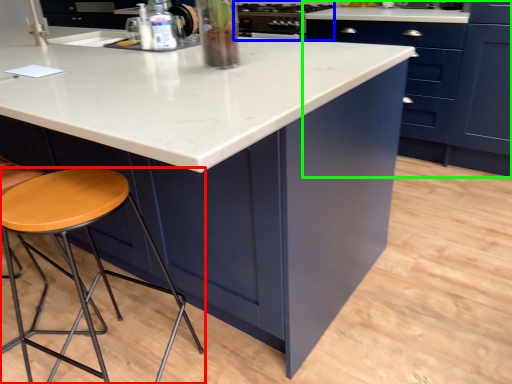
Question: Estimate the real-world distances between objects in this image. Which object is closer to stool (highlighted by a red box), appliance (highlighted by a blue box) or cabinetry (highlighted by a green box)?

Choices:
 (A) appliance
 (B) cabinetry

Answer: (A)